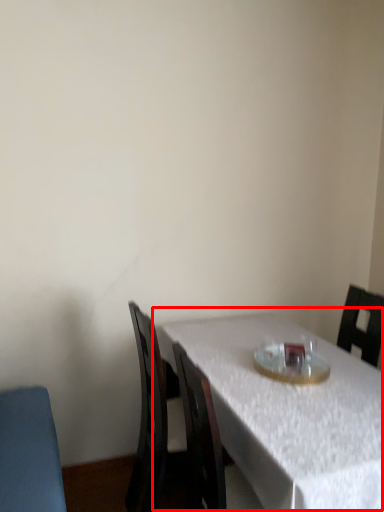
Question: In this image, where is table (annotated by the red box) located relative to tableware?

Choices:
 (A) right
 (B) left

Answer: (B)